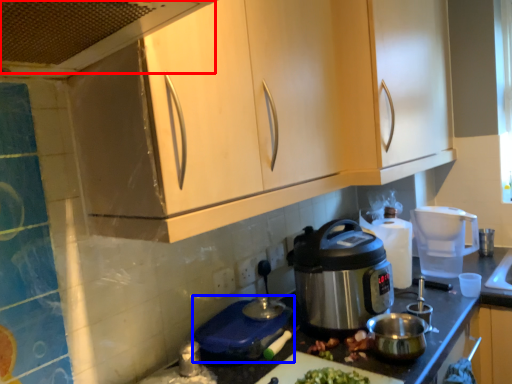
Question: Which of the following is the closest to the observer, exhaust hood (highlighted by a red box) or appliance (highlighted by a blue box)?

Choices:
 (A) exhaust hood
 (B) appliance

Answer: (A)